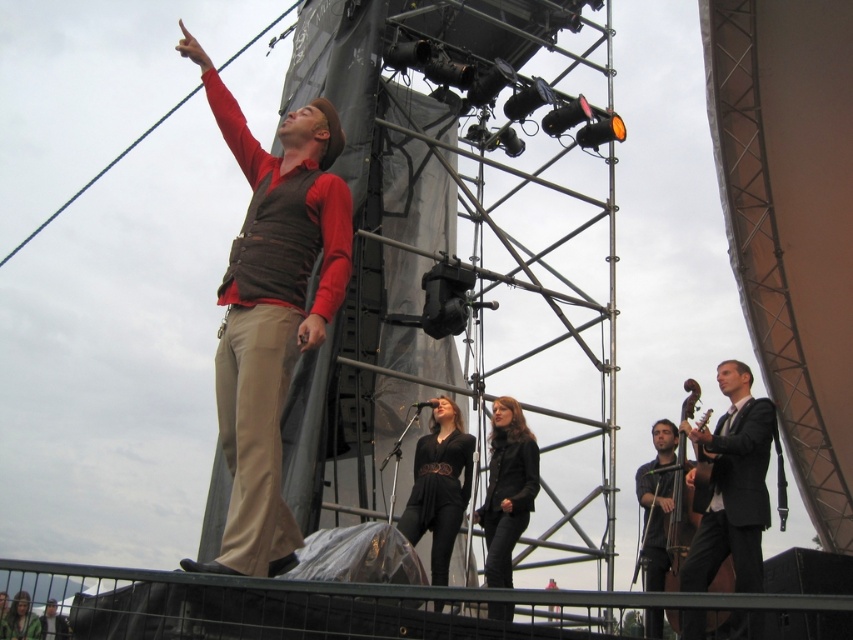
Consider the image. You are a photographer positioned at the center of the stage. You need to take a photo that includes both the point at coordinates point (291, 332) and point (775, 419). Considering their positions, which point should you focus on first to ensure both are in sharp focus?

You should focus on point (291, 332) first because it is closer to the viewer than point (775, 419), ensuring both points are within the depth of field.

You are a photographer at the concert. You need to take a photo that includes both the black suit at right and the black leather dress at center. Which one should you zoom in on to ensure both are clearly visible in the frame?

The black suit at right is bigger than the black leather dress at center, so you should zoom in on the black leather dress at center to ensure both are clearly visible in the frame.

You are an event planner trying to ensure the performers are visible to the audience. You notice the black suit at right and the black leather dress at center. Which performer is blocking the view of the other?

The black suit at right is positioned over the black leather dress at center, so the performer in the black suit at right is blocking the view of the performer in the black leather dress at center.